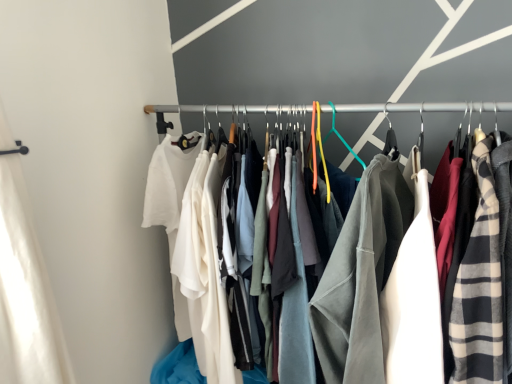
In order to click on textured cotton shirts at center in this screenshot , I will do `click(426, 111)`.

This screenshot has height=384, width=512. Describe the element at coordinates (426, 111) in the screenshot. I see `textured cotton shirts at center` at that location.

Find the location of `textured cotton shirts at center`. textured cotton shirts at center is located at coordinates (426, 111).